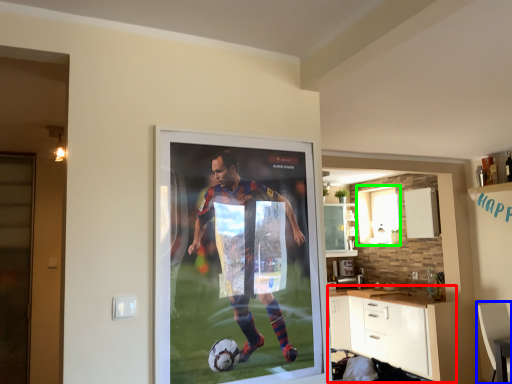
Question: Which object is the farthest from cabinetry (highlighted by a red box)? Choose among these: armchair (highlighted by a blue box) or window (highlighted by a green box).

Choices:
 (A) armchair
 (B) window

Answer: (B)